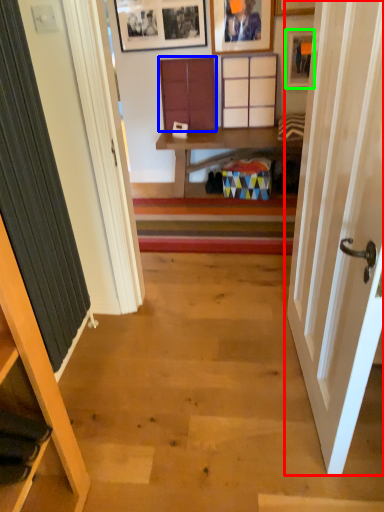
Question: Considering the real-world distances, which object is closest to door (highlighted by a red box)? cabinet (highlighted by a blue box) or picture frame (highlighted by a green box).

Choices:
 (A) cabinet
 (B) picture frame

Answer: (B)